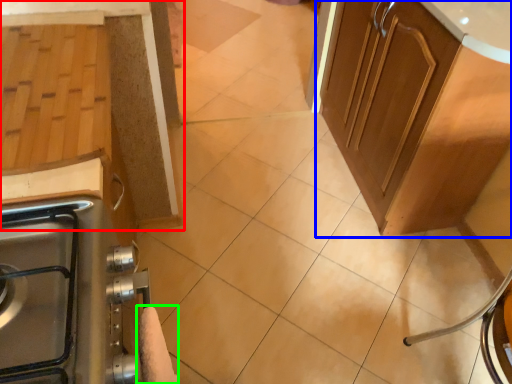
Question: Considering the real-world distances, which object is farthest from cabinetry (highlighted by a red box)? cabinetry (highlighted by a blue box) or hand towel (highlighted by a green box)?

Choices:
 (A) cabinetry
 (B) hand towel

Answer: (A)